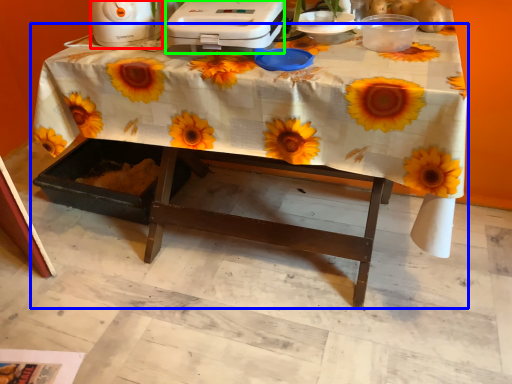
Question: Which object is positioned farthest from appliance (highlighted by a red box)? Select from table (highlighted by a blue box) and appliance (highlighted by a green box).

Choices:
 (A) table
 (B) appliance

Answer: (A)